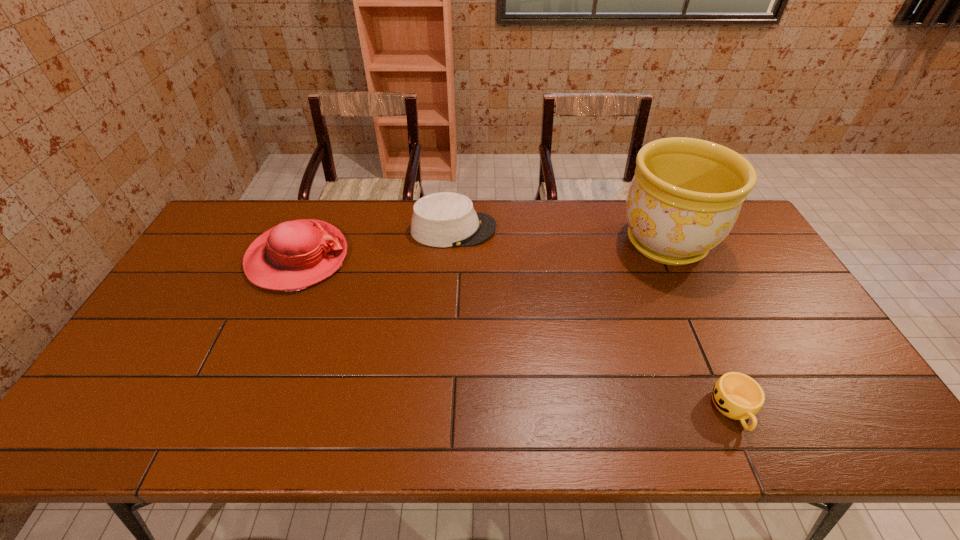
Where is `the tallest object`? Image resolution: width=960 pixels, height=540 pixels. the tallest object is located at coordinates (686, 195).

The image size is (960, 540). I want to click on the left hat, so click(x=293, y=255).

Locate an element on the screen. the second tallest object is located at coordinates (293, 255).

Find the location of a particular element. the right hat is located at coordinates (445, 219).

The width and height of the screenshot is (960, 540). In order to click on the shorter hat in this screenshot , I will do `click(445, 219)`.

The width and height of the screenshot is (960, 540). In order to click on cup in this screenshot , I will do `click(736, 395)`.

Where is `the nearest object`? the nearest object is located at coordinates (736, 395).

Image resolution: width=960 pixels, height=540 pixels. What are the coordinates of `vacant space located 0.400m on the front of the flowerpot` in the screenshot? It's located at (736, 396).

Image resolution: width=960 pixels, height=540 pixels. What are the coordinates of `vacant area situated at the front of the leftmost object with a bow` in the screenshot? It's located at (456, 258).

Locate an element on the screen. vacant point located on the front-facing side of the second shortest object is located at coordinates (614, 230).